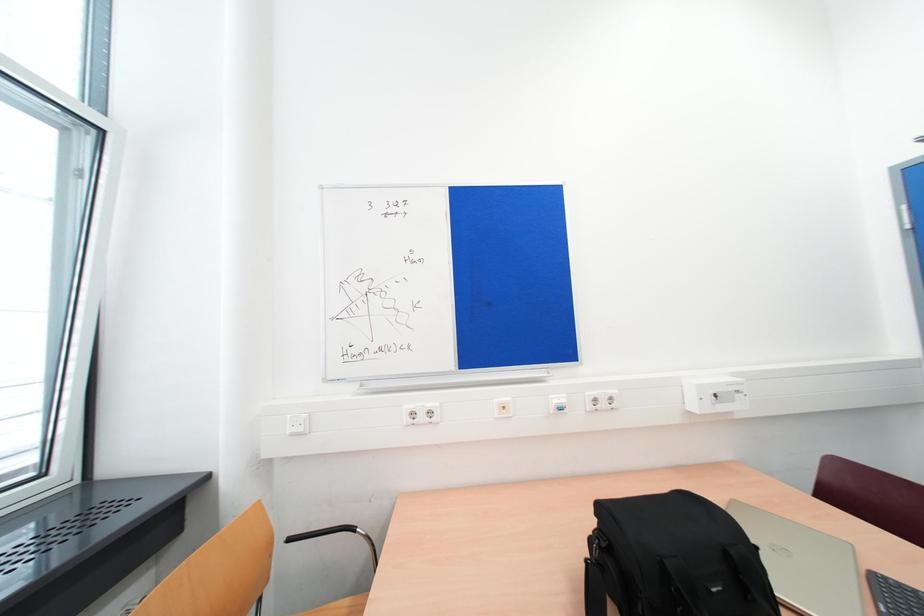
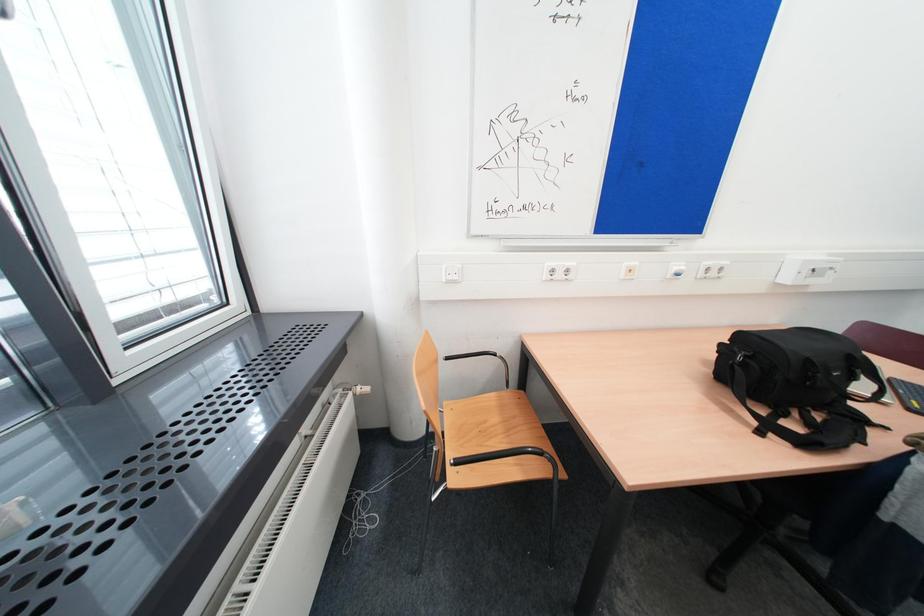
Question: The images are taken continuously from a first-person perspective. In which direction is your viewpoint rotating?

Choices:
 (A) Left
 (B) Right
 (C) Up
 (D) Down

Answer: (D)